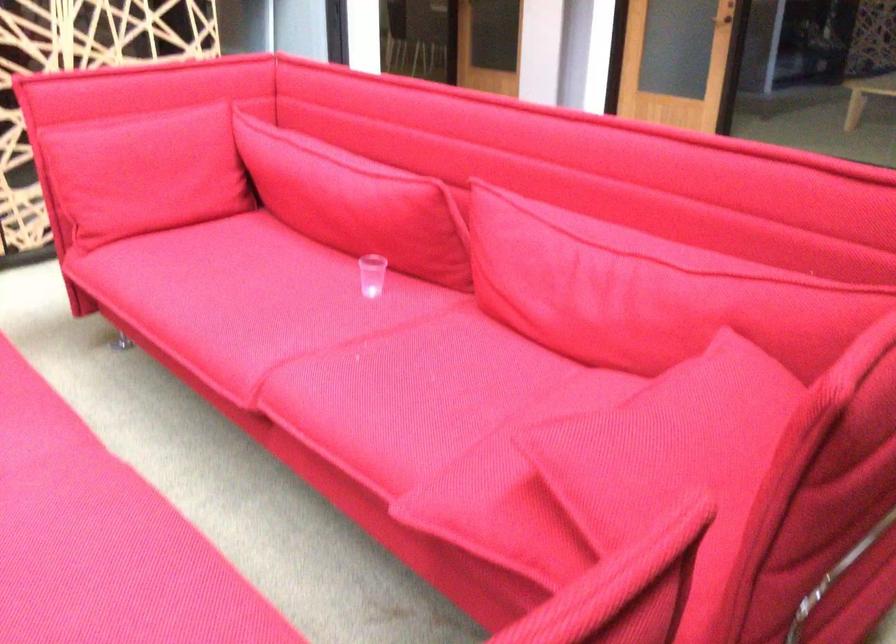
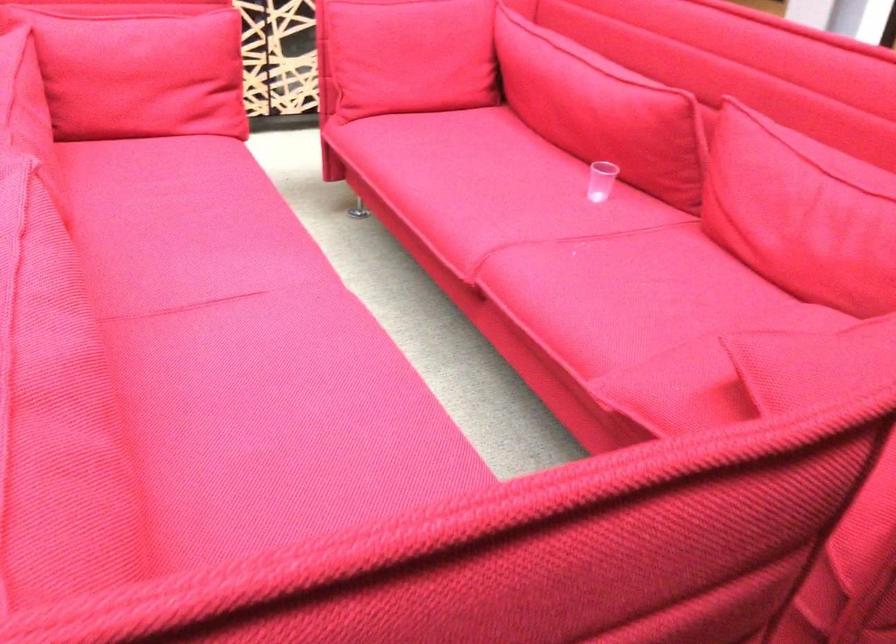
Locate, in the second image, the point that corresponds to [357,205] in the first image.

(601, 109)